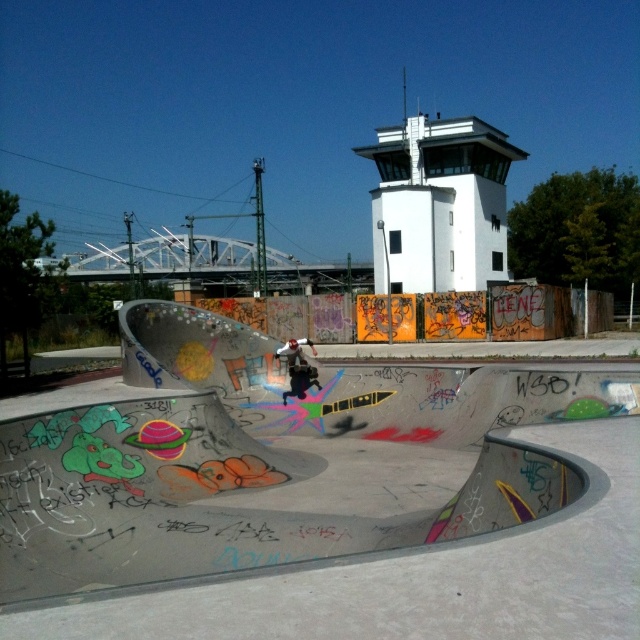
Is point (396, 289) closer to camera compared to point (310, 365)?

No.

Who is more forward, (449, 125) or (294, 362)?

Point (294, 362) is more forward.

Between point (474, 262) and point (292, 371), which one is positioned in front?

Point (292, 371) is in front.

At what (x,y) coordinates should I click in order to perform the action: click on white smooth control tower at upper center. Please return your answer as a coordinate pair (x, y). Looking at the image, I should click on (440, 204).

Which of these two, concrete skate park at center or white smooth control tower at upper center, stands shorter?

concrete skate park at center

Is point (438, 476) in front of point (490, 225)?

Yes.

Is point (380, 467) closer to camera compared to point (493, 173)?

Yes, it is in front of point (493, 173).

Where is `concrete skate park at center`? concrete skate park at center is located at coordinates [317, 496].

Is concrete skate park at center shorter than blue glossy skateboard at center?

Incorrect, concrete skate park at center's height does not fall short of blue glossy skateboard at center's.

Is concrete skate park at center thinner than blue glossy skateboard at center?

In fact, concrete skate park at center might be wider than blue glossy skateboard at center.

The width and height of the screenshot is (640, 640). What do you see at coordinates (317, 496) in the screenshot? I see `concrete skate park at center` at bounding box center [317, 496].

You are a GUI agent. You are given a task and a screenshot of the screen. Output one action in this format:
    pyautogui.click(x=<x>, y=<y>)
    Task: Click on the concrete skate park at center
    The width and height of the screenshot is (640, 640).
    Given the screenshot: What is the action you would take?
    pyautogui.click(x=317, y=496)